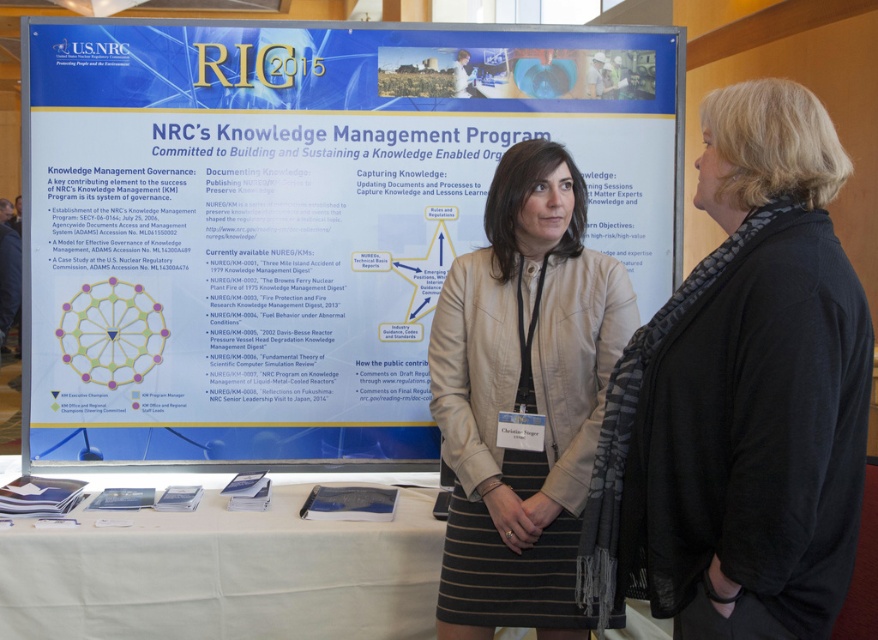
Who is more forward, (767, 268) or (299, 532)?

Point (767, 268) is more forward.

Does black scarf at right come behind white cloth-covered table at lower left?

That is False.

Does point (781, 150) come farther from viewer compared to point (169, 589)?

No, (781, 150) is closer to viewer.

This screenshot has width=878, height=640. Identify the location of black scarf at right. (740, 397).

Which is below, white paperboard poster at center or beige leather jacket at center?

beige leather jacket at center is lower down.

What do you see at coordinates (299, 220) in the screenshot? This screenshot has height=640, width=878. I see `white paperboard poster at center` at bounding box center [299, 220].

Identify the location of white paperboard poster at center. (299, 220).

Is white paperboard poster at center to the left of white cloth-covered table at lower left from the viewer's perspective?

No, white paperboard poster at center is not to the left of white cloth-covered table at lower left.

Looking at this image, can you confirm if white paperboard poster at center is positioned to the right of white cloth-covered table at lower left?

Indeed, white paperboard poster at center is positioned on the right side of white cloth-covered table at lower left.

This screenshot has width=878, height=640. I want to click on white paperboard poster at center, so click(299, 220).